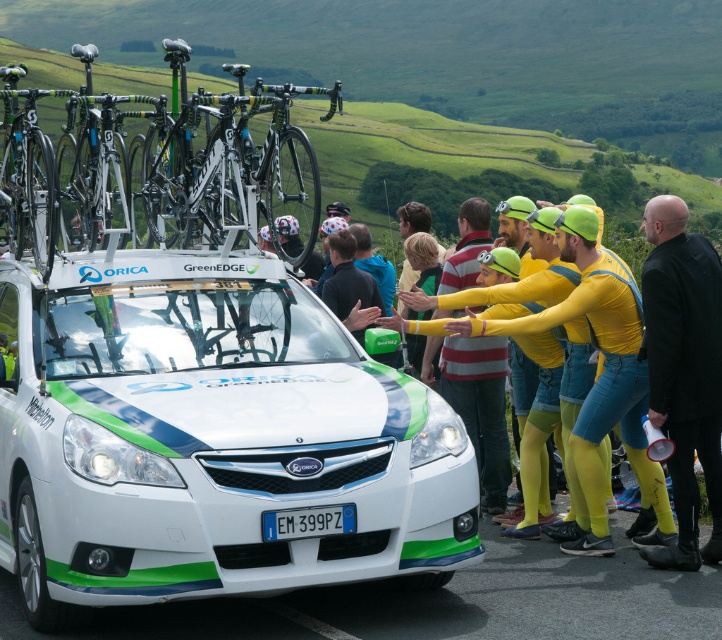
You are a photographer at the cycling event. You need to capture a photo that includes both the white glossy car at center and the black leather jacket at right. Given that your camera has a limited field of view, which object should you position closer to the camera to ensure both are in frame without cropping?

Since the white glossy car at center is larger than the black leather jacket at right, you should position the black leather jacket at right closer to the camera to balance their sizes in the frame.

You are a spectator standing at the edge of the cycling event. There is a white glossy car at center that you want to take a photo of. Considering the distance between you and the car, can you capture the entire car in your smartphone camera without zooming in?

The distance between you and the white glossy car at center is 19.05 feet. Since most smartphones can capture objects within this range without zooming, you should be able to take a photo of the entire car without needing to zoom in.

You are a photographer at the cycling event. You want to capture a photo that includes both the white glossy car at center and the shiny black bike at upper left. Which object should be placed closer to the camera to ensure both fit in the frame?

The white glossy car at center is shorter than the shiny black bike at upper left, so placing the shiny black bike at upper left closer to the camera will help both objects fit within the frame since it is taller and requires more space vertically.